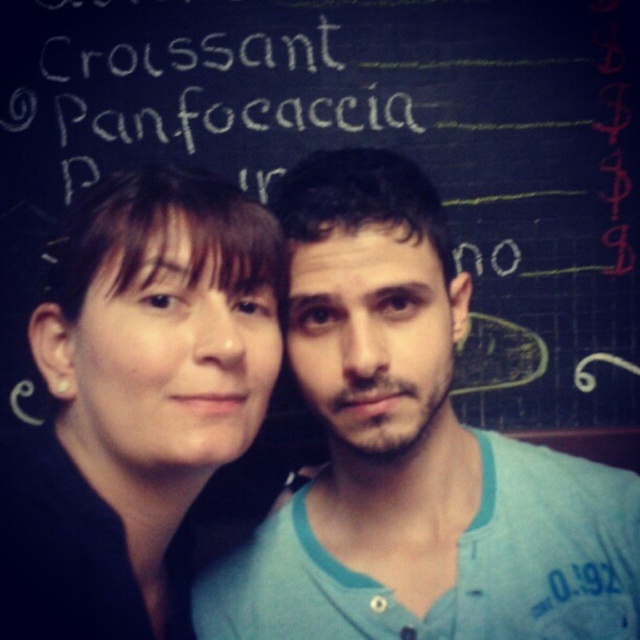
You are a photographer setting up a shot of the two people in front of the black chalkboard at upper center. You want to ensure the white chalk writing at upper center is visible in the background. Will the current arrangement allow you to see the writing clearly?

The white chalk writing at upper center is behind the black chalkboard at upper center, so it will not be visible in the background as the black chalkboard is blocking it.

You are a photographer setting up for a group photo. You need to ensure that both the black chalkboard at upper center and the blue cotton shirt at center are clearly visible in the frame. Based on their positions, which object should you focus on first to ensure both are in focus?

The black chalkboard at upper center is located above the blue cotton shirt at center, so you should focus on the blue cotton shirt at center first to ensure both are in focus since it is closer to the camera.